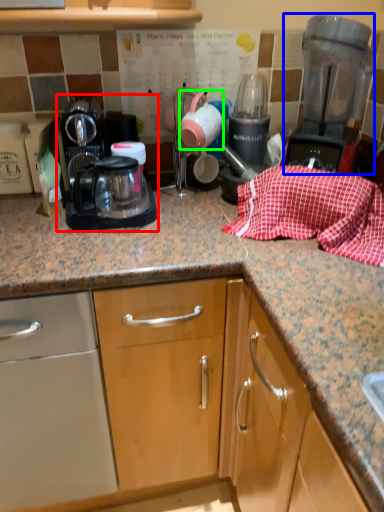
Question: Considering the real-world distances, which object is farthest from kitchen appliance (highlighted by a red box)? home appliance (highlighted by a blue box) or tea pot (highlighted by a green box)?

Choices:
 (A) home appliance
 (B) tea pot

Answer: (A)